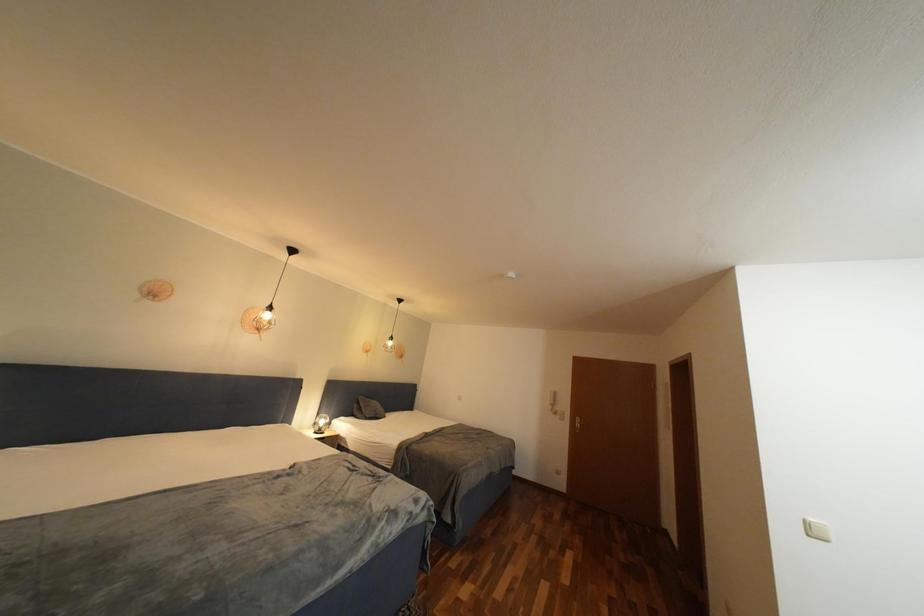
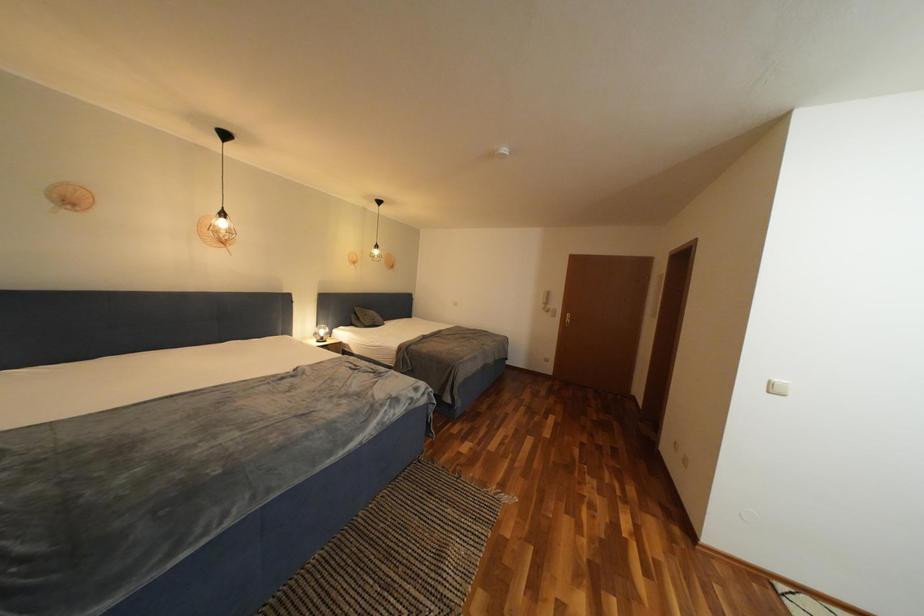
Question: Based on the continuous images, in which direction is the camera rotating? Reply with the corresponding letter.

Choices:
 (A) Left
 (B) Right
 (C) Up
 (D) Down

Answer: (D)